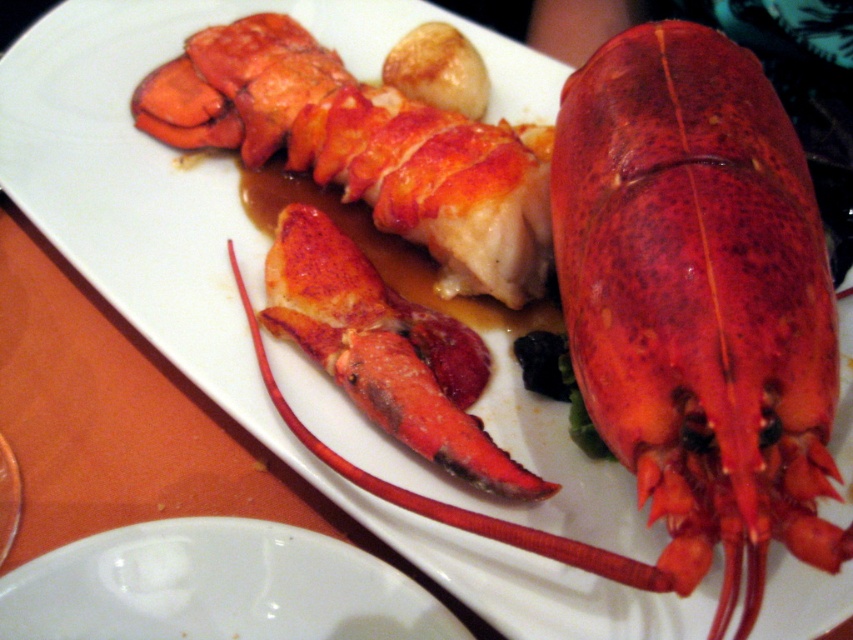
You are a food critic evaluating the presentation of this dish. Based on the scene, which object, the shiny red lobster at center or the white glossy plate at lower center, appears more elevated in height?

The shiny red lobster at center has a greater height compared to the white glossy plate at lower center, so the shiny red lobster at center appears more elevated in height.

Where is the shiny red lobster at center located in the image?

The shiny red lobster at center is located at point (740, 148).